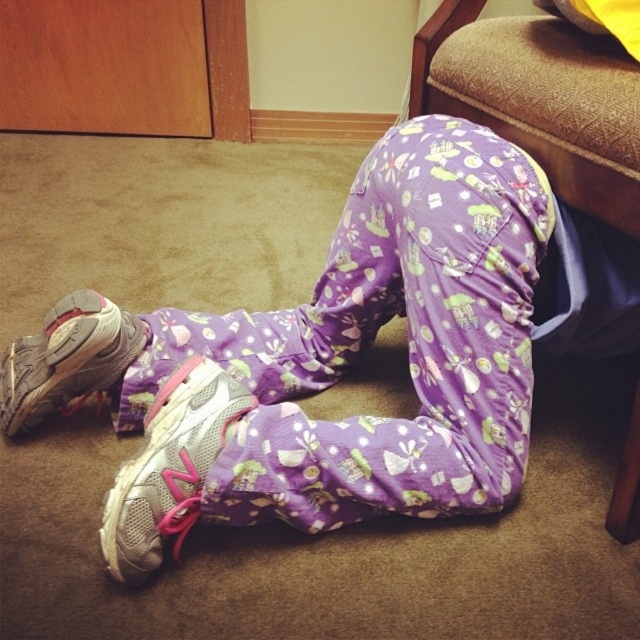
You are a delivery robot that needs to place a small package between the purple cotton pants at lower center and the silver mesh sneaker at lower left. Can you fit the package in the space between them?

The distance between the purple cotton pants at lower center and the silver mesh sneaker at lower left is 8.89 inches. If the package is smaller than this measurement, it can fit in the space between them.

You are a delivery person who needs to place a small package between the purple cotton pants at lower center and the silver mesh shoe at lower left. Based on their positions, where should you place the package?

Since the purple cotton pants at lower center are to the right of the silver mesh shoe at lower left, you should place the package between them on the side closer to the silver mesh shoe at lower left.

You are standing in the room and see two points marked in the image. Which point is closer to you, point (349, 432) or point (157, 545)?

Point (349, 432) is further to the viewer than point (157, 545), so point (349, 432) is closer to you.